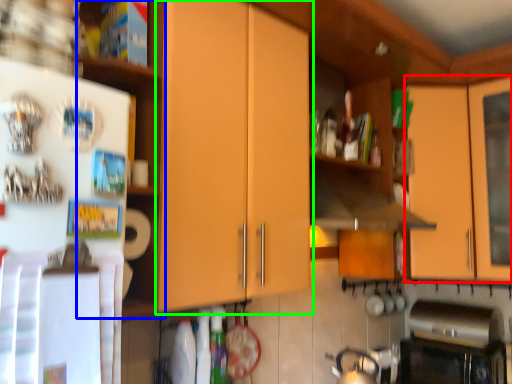
Question: Considering the real-world distances, which object is closest to cabinetry (highlighted by a red box)? shelf (highlighted by a blue box) or cabinetry (highlighted by a green box).

Choices:
 (A) shelf
 (B) cabinetry

Answer: (B)